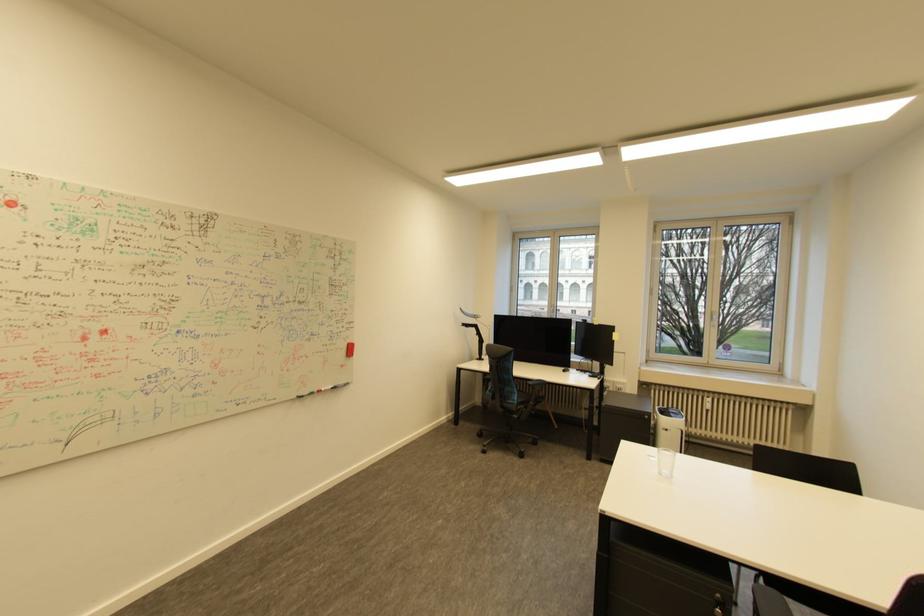
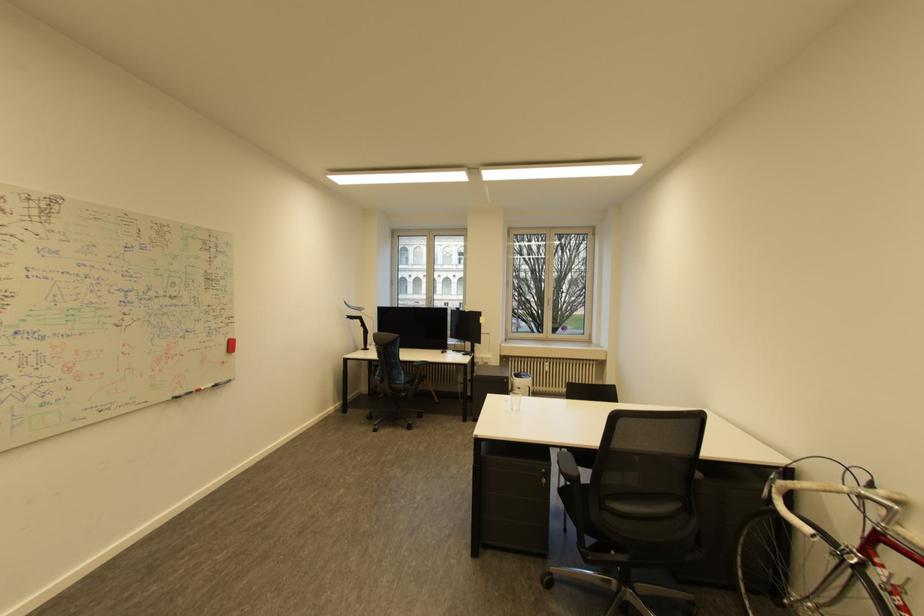
Question: The camera is either moving clockwise (left) or counter-clockwise (right) around the object. The first image is from the beginning of the video and the second image is from the end. Is the camera moving left or right when shooting the video?

Choices:
 (A) Left
 (B) Right

Answer: (A)